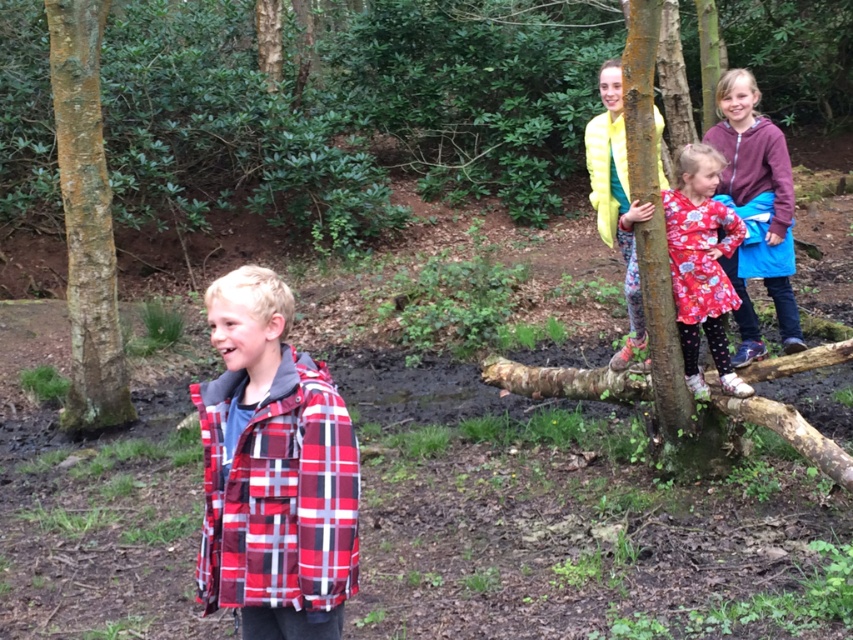
You are standing at point (743, 204) and want to walk to point (100, 202). Which direction should you move in to get there?

You should move forward because point (100, 202) is behind point (743, 204).